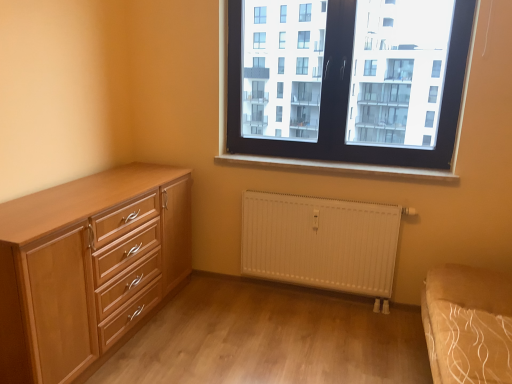
Locate an element on the screen. free space above light wood chest of drawers at left (from a real-world perspective) is located at coordinates point(59,200).